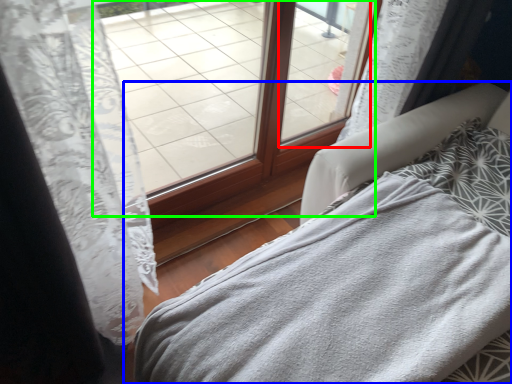
Question: Considering the real-world distances, which object is closest to window (highlighted by a red box)? furniture (highlighted by a blue box) or window (highlighted by a green box).

Choices:
 (A) furniture
 (B) window

Answer: (B)